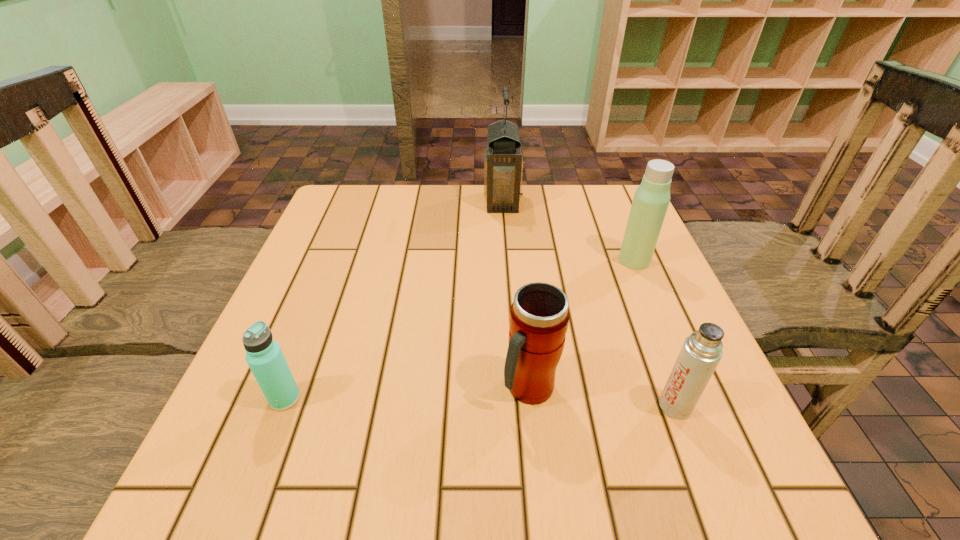
Image resolution: width=960 pixels, height=540 pixels. Identify the location of free spot between the farthest object and the second farthest object. (568, 231).

What are the coordinates of `vacant space in between the farthest thermos bottle and the second thermos bottle from left to right` in the screenshot? It's located at (582, 324).

Find the location of a particular element. This screenshot has width=960, height=540. blank region between the tallest object and the leftmost object is located at coordinates click(x=394, y=300).

Where is `unoccupied area between the farthest thermos bottle and the second thermos bottle from left to right`? This screenshot has width=960, height=540. unoccupied area between the farthest thermos bottle and the second thermos bottle from left to right is located at coordinates (582, 324).

Find the location of a particular element. The width and height of the screenshot is (960, 540). free space between the second thermos bottle from left to right and the fourth nearest object is located at coordinates (582, 324).

You are a GUI agent. You are given a task and a screenshot of the screen. Output one action in this format:
    pyautogui.click(x=<x>, y=<y>)
    Task: Click on the free spot between the fourth nearest object and the third thermos bottle from right to left
    
    Given the screenshot: What is the action you would take?
    (x=582, y=324)

I want to click on vacant space that's between the second thermos bottle from left to right and the leftmost object, so click(x=407, y=393).

Identify which object is the third nearest to the leftmost object. Please provide its 2D coordinates. Your answer should be formatted as a tuple, i.e. [(x, y)], where the tuple contains the x and y coordinates of a point satisfying the conditions above.

[(503, 162)]

Select which object is the third closest to the tallest object. Please provide its 2D coordinates. Your answer should be formatted as a tuple, i.e. [(x, y)], where the tuple contains the x and y coordinates of a point satisfying the conditions above.

[(701, 352)]

Find the location of a particular element. thermos bottle that is the third closest to the second thermos bottle from left to right is located at coordinates (264, 356).